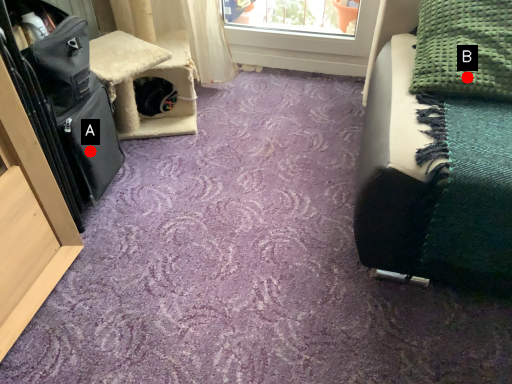
Question: Two points are circled on the image, labeled by A and B beside each circle. Which point is farther to the camera?

Choices:
 (A) A is further
 (B) B is further

Answer: (A)